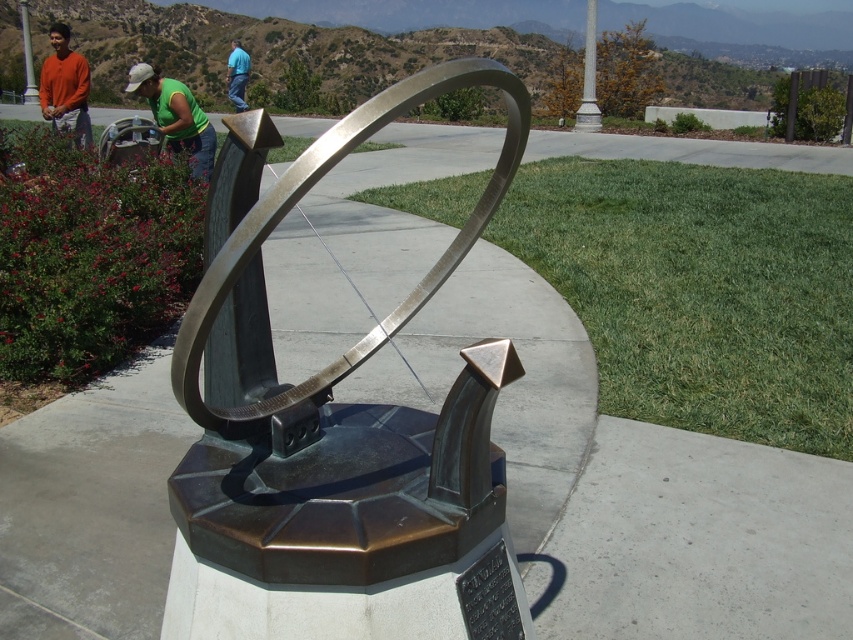
Does point (132, 83) come in front of point (44, 104)?

Yes, point (132, 83) is closer to viewer.

Does green fabric shirt at upper left appear over orange shirt at left?

Incorrect, green fabric shirt at upper left is not positioned above orange shirt at left.

Which is in front, point (190, 116) or point (61, 81)?

Point (190, 116) is more forward.

Find the location of a particular element. green fabric shirt at upper left is located at coordinates (177, 116).

Which is more to the left, green fabric shirt at upper left or blue shirt at upper center?

blue shirt at upper center

Is green fabric shirt at upper left thinner than blue shirt at upper center?

Yes, green fabric shirt at upper left is thinner than blue shirt at upper center.

Between point (202, 122) and point (245, 54), which one is positioned behind?

The point (245, 54) is behind.

In order to click on green fabric shirt at upper left in this screenshot , I will do `click(177, 116)`.

Does polished bronze sundial at center appear on the right side of blue shirt at upper center?

Correct, you'll find polished bronze sundial at center to the right of blue shirt at upper center.

What do you see at coordinates (316, 385) in the screenshot? This screenshot has height=640, width=853. I see `polished bronze sundial at center` at bounding box center [316, 385].

Between point (370, 435) and point (230, 56), which one is positioned behind?

The point (230, 56) is more distant.

Locate an element on the screen. Image resolution: width=853 pixels, height=640 pixels. polished bronze sundial at center is located at coordinates (316, 385).